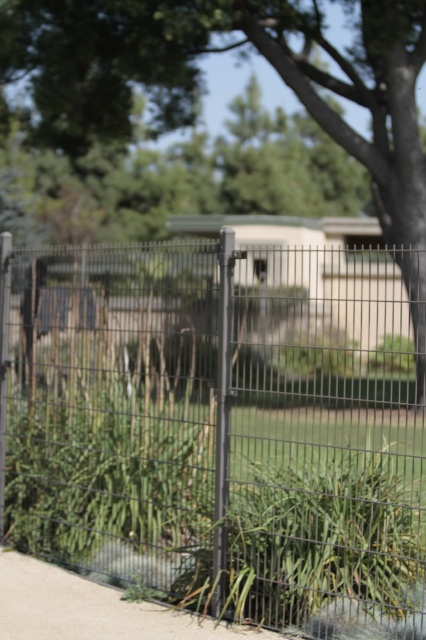
Who is positioned more to the left, black wire mesh fence at center or green leafy tree at upper center?

From the viewer's perspective, black wire mesh fence at center appears more on the left side.

Based on the photo, can you confirm if black wire mesh fence at center is positioned to the left of green leafy tree at upper center?

Indeed, black wire mesh fence at center is positioned on the left side of green leafy tree at upper center.

At what (x,y) coordinates should I click in order to perform the action: click on black wire mesh fence at center. Please return your answer as a coordinate pair (x, y). Looking at the image, I should click on (216, 433).

You are a GUI agent. You are given a task and a screenshot of the screen. Output one action in this format:
    pyautogui.click(x=<x>, y=<y>)
    Task: Click on the black wire mesh fence at center
    
    Given the screenshot: What is the action you would take?
    216,433